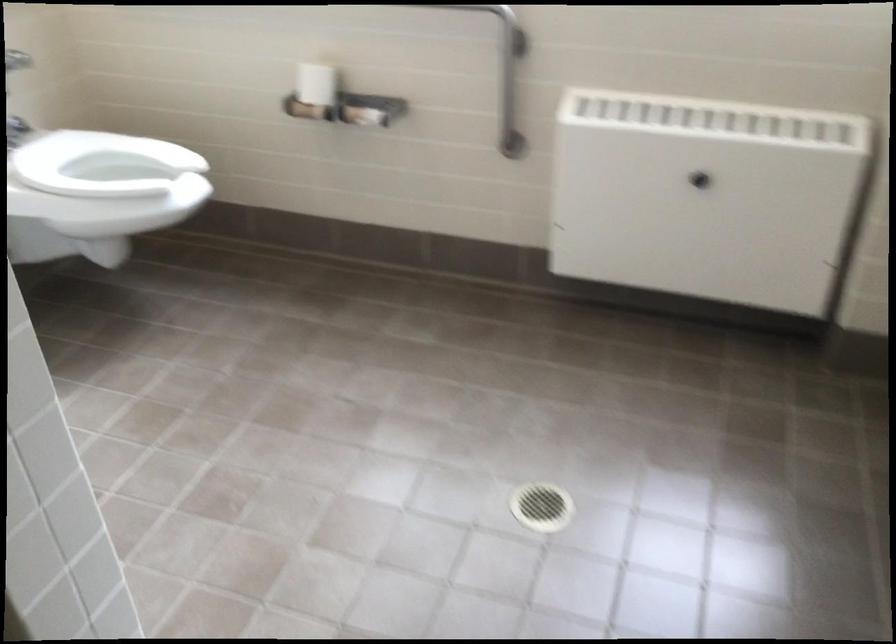
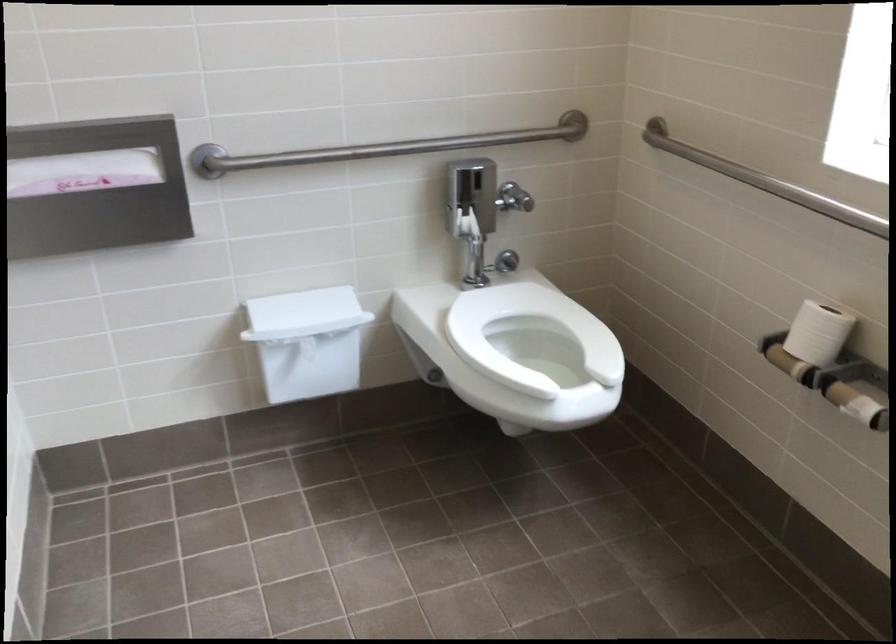
Question: How did the camera likely rotate?

Choices:
 (A) Left
 (B) Right
 (C) Up
 (D) Down

Answer: (A)